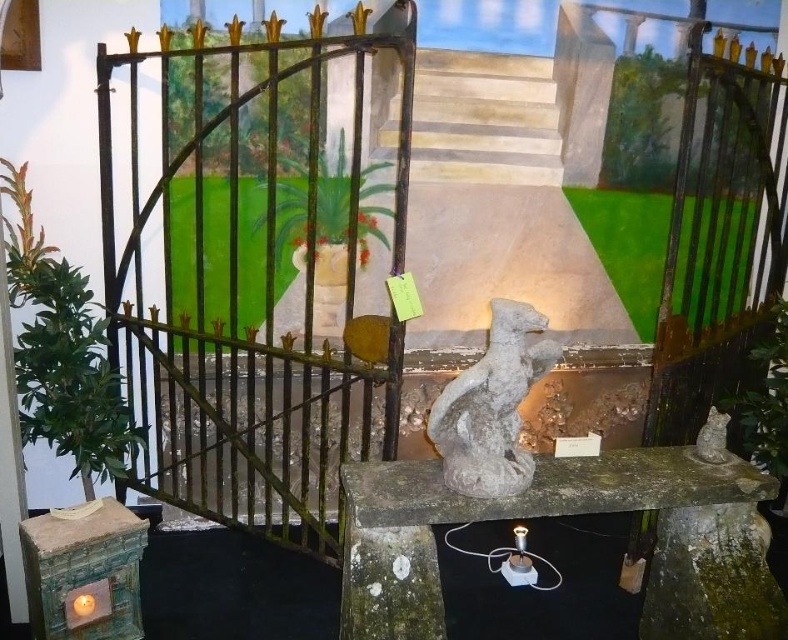
Can you confirm if beige stone stairs at upper center is thinner than gray stone cat at center?

No.

Is beige stone stairs at upper center to the right of gray stone cat at center from the viewer's perspective?

Indeed, beige stone stairs at upper center is positioned on the right side of gray stone cat at center.

Describe the element at coordinates (484, 120) in the screenshot. I see `beige stone stairs at upper center` at that location.

In order to click on beige stone stairs at upper center in this screenshot , I will do `click(484, 120)`.

How far apart are green matte vase at center and green matte plant at center?

They are 1.51 meters apart.

From the picture: Is the position of green matte vase at center more distant than that of green matte plant at center?

No, it is in front of green matte plant at center.

You are a GUI agent. You are given a task and a screenshot of the screen. Output one action in this format:
    pyautogui.click(x=<x>, y=<y>)
    Task: Click on the green matte vase at center
    Image resolution: width=788 pixels, height=640 pixels.
    Given the screenshot: What is the action you would take?
    (236, 252)

Locate an element on the screen. green matte vase at center is located at coordinates (236, 252).

Does green matte vase at center appear on the left side of green leafy plant at right?

Yes, green matte vase at center is to the left of green leafy plant at right.

Who is more distant from viewer, (175,228) or (746,424)?

The point (746,424) is behind.

At what (x,y) coordinates should I click in order to perform the action: click on green matte vase at center. Please return your answer as a coordinate pair (x, y). Image resolution: width=788 pixels, height=640 pixels. Looking at the image, I should click on (236, 252).